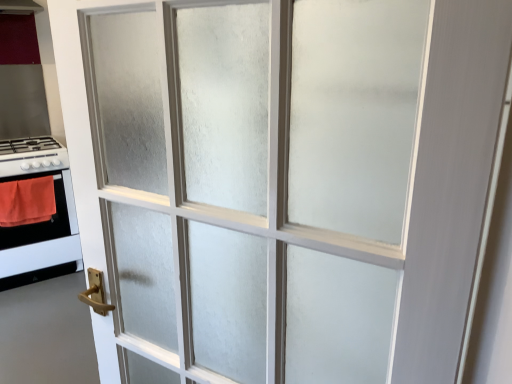
Question: Is wooden handle at lower left closer to camera compared to white glossy stove at left?

Choices:
 (A) no
 (B) yes

Answer: (B)

Question: Considering the relative sizes of wooden handle at lower left and white glossy stove at left in the image provided, is wooden handle at lower left bigger than white glossy stove at left?

Choices:
 (A) yes
 (B) no

Answer: (B)

Question: From the image's perspective, would you say wooden handle at lower left is shown under white glossy stove at left?

Choices:
 (A) yes
 (B) no

Answer: (A)

Question: Is wooden handle at lower left not inside white glossy stove at left?

Choices:
 (A) no
 (B) yes

Answer: (B)

Question: From a real-world perspective, is wooden handle at lower left on top of white glossy stove at left?

Choices:
 (A) yes
 (B) no

Answer: (B)

Question: Is wooden handle at lower left at the right side of white glossy stove at left?

Choices:
 (A) no
 (B) yes

Answer: (B)

Question: Is white glossy gas stove at left in front of wooden handle at lower left?

Choices:
 (A) no
 (B) yes

Answer: (A)

Question: From a real-world perspective, does white glossy gas stove at left sit lower than wooden handle at lower left?

Choices:
 (A) no
 (B) yes

Answer: (A)

Question: Does white glossy gas stove at left have a larger size compared to wooden handle at lower left?

Choices:
 (A) yes
 (B) no

Answer: (B)

Question: From the image's perspective, is white glossy gas stove at left above wooden handle at lower left?

Choices:
 (A) no
 (B) yes

Answer: (B)

Question: Can you confirm if white glossy gas stove at left is wider than wooden handle at lower left?

Choices:
 (A) no
 (B) yes

Answer: (A)

Question: Considering the relative sizes of white glossy gas stove at left and wooden handle at lower left in the image provided, is white glossy gas stove at left smaller than wooden handle at lower left?

Choices:
 (A) yes
 (B) no

Answer: (A)

Question: From a real-world perspective, does orange fabric at left stand above white glossy gas stove at left?

Choices:
 (A) no
 (B) yes

Answer: (A)